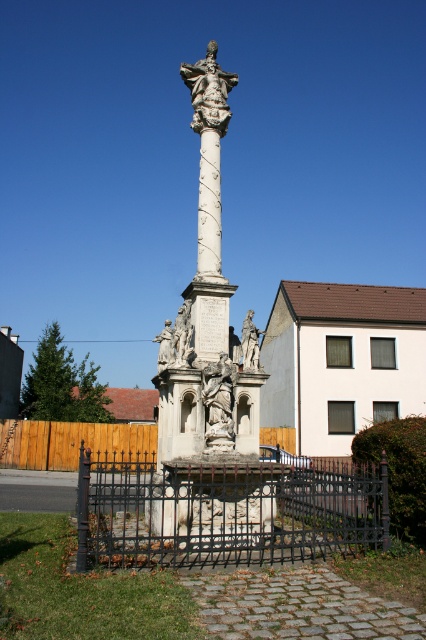
Consider the image. You are standing in front of the monument and want to take a photo of the white stone statue at center without the wooden fence at lower left blocking the view. Which direction should you move to achieve this?

Move to the right side of the wooden fence at lower left so that the white stone statue at center is no longer blocked by the fence.

Looking at this image, you are standing at the center of the monument and want to exit through the wooden fence at lower left. Which direction should you walk to reach it?

The wooden fence at lower left is located at coordinates point (71, 442), so you should walk towards the lower left direction to reach it.

In the scene shown: You are standing in front of the monument and want to take a photo of the monument. The camera you are using has a maximum focus range of 15 meters. Is the point at coordinates point (x=213, y=248) within the camera focus range?

The distance of point (x=213, y=248) from the camera is 15.03 meters, which is slightly beyond the camera focus range of 15 meters. Therefore, the camera cannot focus on that point.